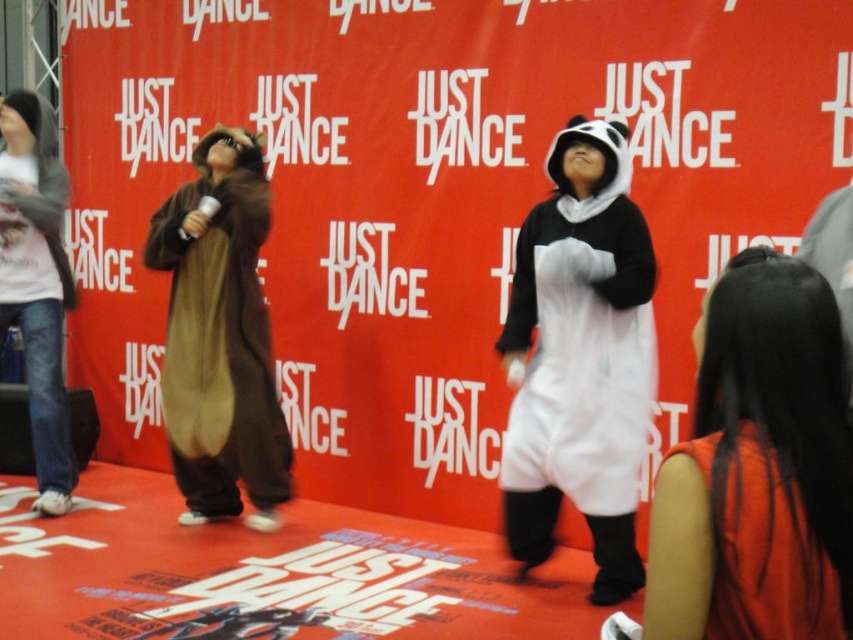
Is point (579, 472) farther from camera compared to point (24, 192)?

No, it is not.

How much distance is there between white plush panda at center and jeans at left?

They are 8.42 feet apart.

Which is in front, point (560, 284) or point (57, 150)?

Point (560, 284) is more forward.

Locate an element on the screen. The width and height of the screenshot is (853, 640). white plush panda at center is located at coordinates click(579, 358).

Who is more distant from viewer, (x=283, y=452) or (x=44, y=129)?

The point (x=44, y=129) is more distant.

Based on the photo, is brown furry onesie at left below jeans at left?

Indeed, brown furry onesie at left is positioned under jeans at left.

Which is in front, point (234, 433) or point (33, 312)?

Point (234, 433) is more forward.

You are a GUI agent. You are given a task and a screenshot of the screen. Output one action in this format:
    pyautogui.click(x=<x>, y=<y>)
    Task: Click on the brown furry onesie at left
    
    Given the screenshot: What is the action you would take?
    pyautogui.click(x=219, y=337)

Can you confirm if silky orange dress at lower right is positioned to the left of brown furry onesie at left?

Incorrect, silky orange dress at lower right is not on the left side of brown furry onesie at left.

Which is above, silky orange dress at lower right or brown furry onesie at left?

brown furry onesie at left is above.

Is point (834, 493) positioned after point (196, 308)?

No, (834, 493) is closer to viewer.

The width and height of the screenshot is (853, 640). What are the coordinates of `silky orange dress at lower right` in the screenshot? It's located at (758, 472).